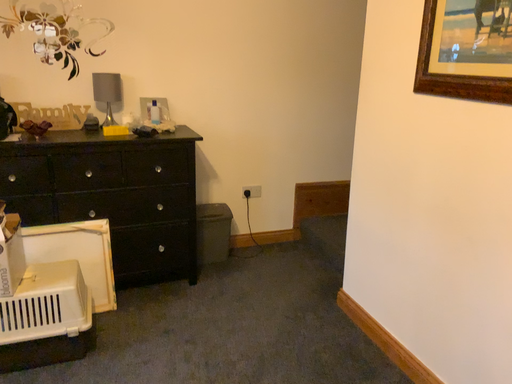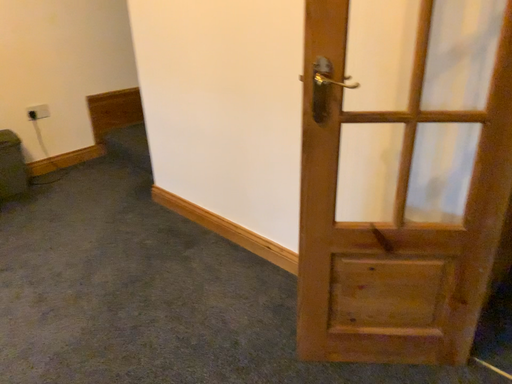
Question: How did the camera likely rotate when shooting the video?

Choices:
 (A) rotated upward
 (B) rotated downward

Answer: (B)